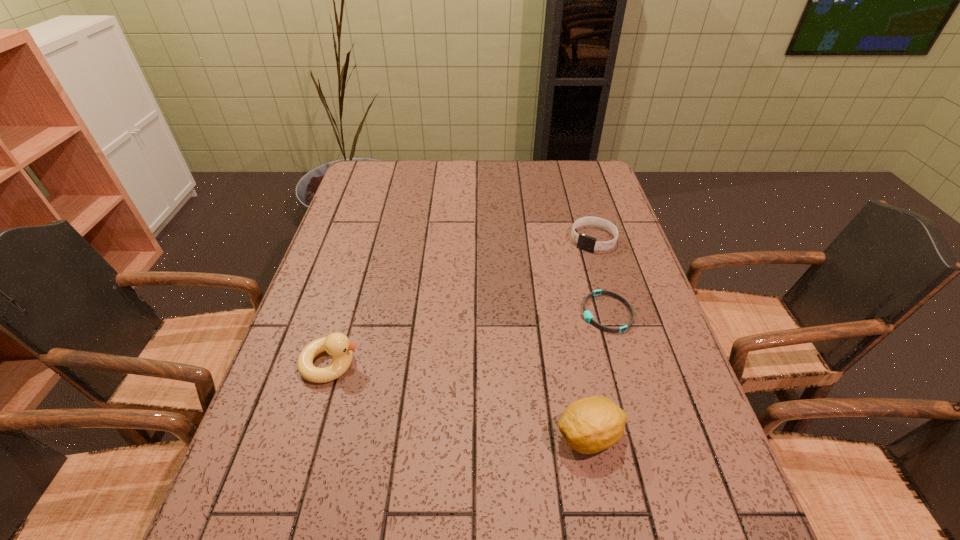
Locate an element on the screen. The width and height of the screenshot is (960, 540). the leftmost object is located at coordinates (337, 345).

Locate an element on the screen. The width and height of the screenshot is (960, 540). the second nearest object is located at coordinates (337, 345).

Where is `lemon`? The image size is (960, 540). lemon is located at coordinates point(589,425).

Identify the location of the shortest object. (587, 315).

Where is `the shorter wristband`? This screenshot has height=540, width=960. the shorter wristband is located at coordinates (587, 315).

The width and height of the screenshot is (960, 540). Identify the location of the farthest object. (584, 242).

The height and width of the screenshot is (540, 960). I want to click on the taller wristband, so click(x=584, y=242).

What are the coordinates of `vacant space located 0.250m at the beak of the third farthest object` in the screenshot? It's located at (470, 363).

The height and width of the screenshot is (540, 960). I want to click on vacant space situated at the stem end of the nearest object, so click(389, 436).

At what (x,y) coordinates should I click in order to perform the action: click on vacant area situated at the stem end of the nearest object. Please return your answer as a coordinate pair (x, y). The width and height of the screenshot is (960, 540). Looking at the image, I should click on tap(479, 436).